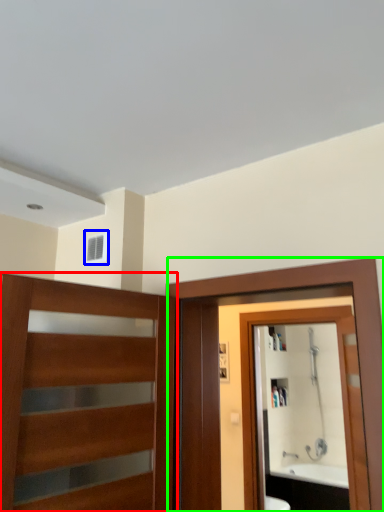
Question: Which is nearer to the door (highlighted by a red box)? window (highlighted by a blue box) or screen door (highlighted by a green box).

Choices:
 (A) window
 (B) screen door

Answer: (B)